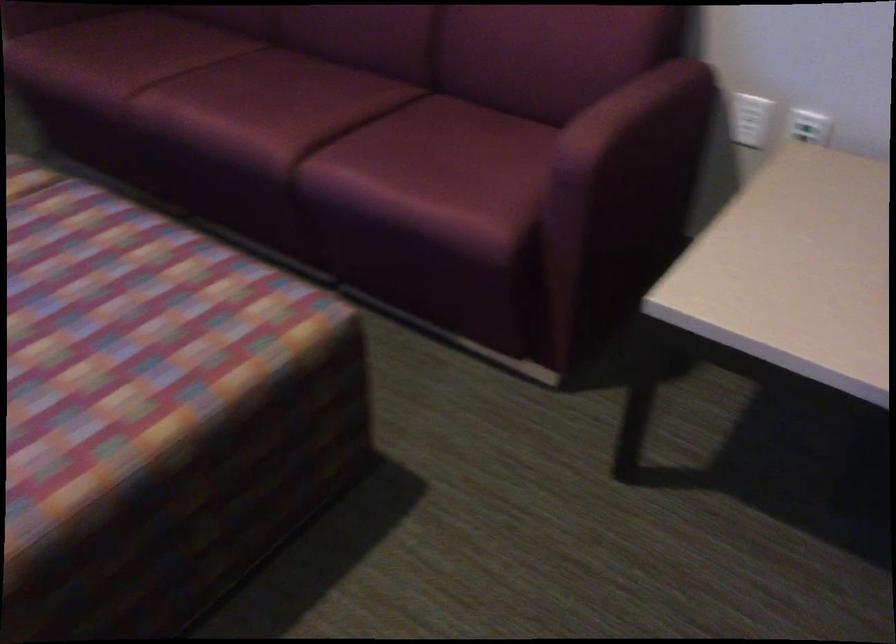
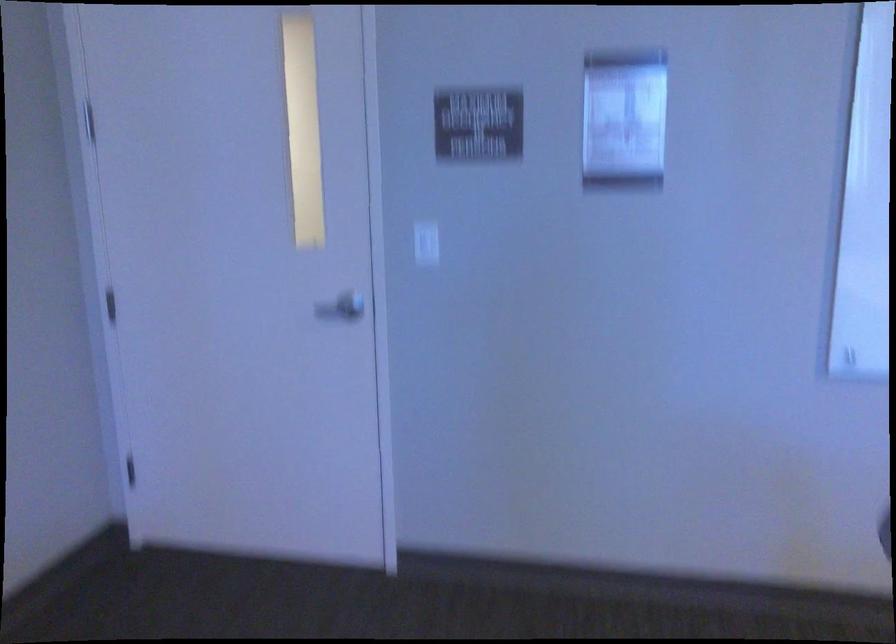
Consider the image. The images are taken continuously from a first-person perspective. In which direction is your viewpoint rotating?

The rotation direction of the camera is right-down.